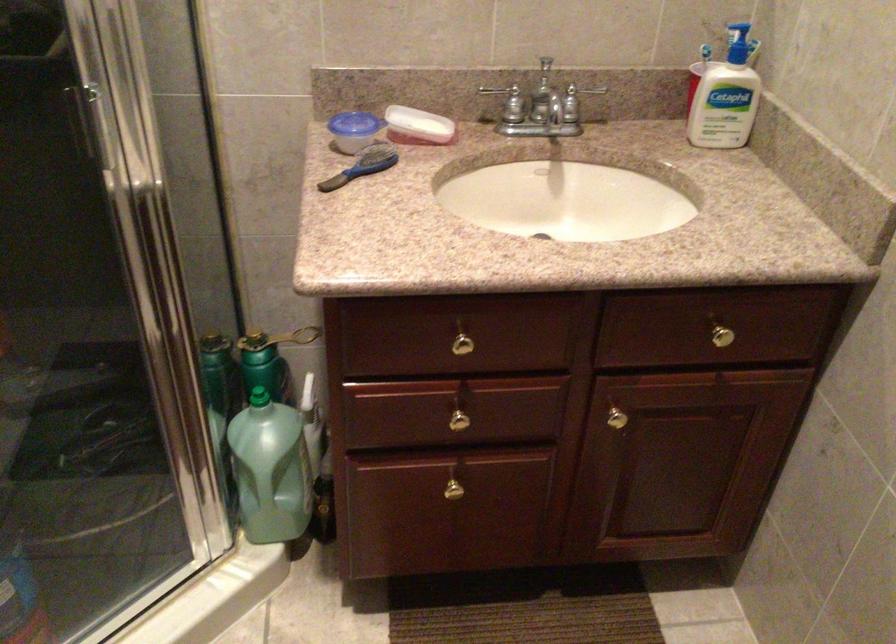
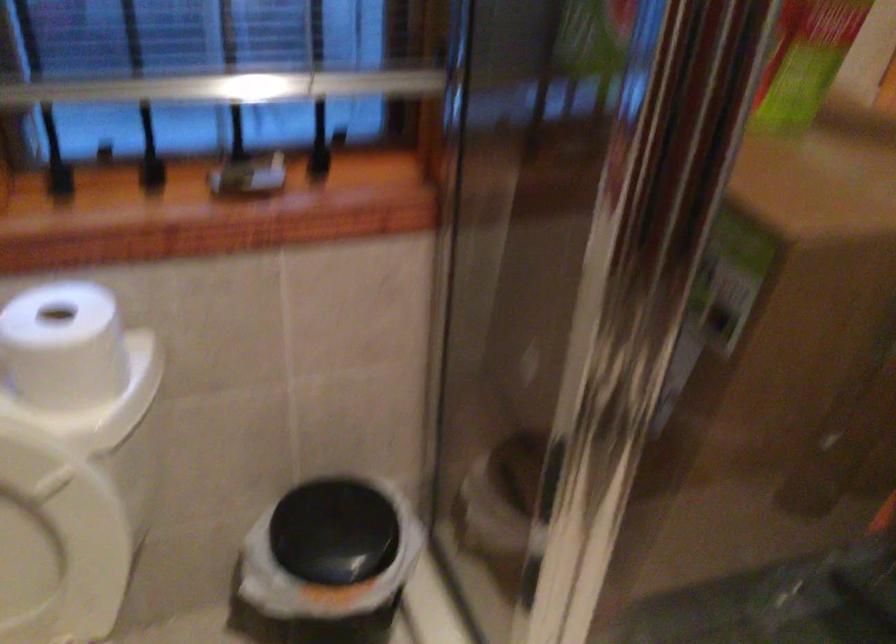
The images are taken continuously from a first-person perspective. In which direction is your viewpoint rotating?

The camera rotated toward left-down.